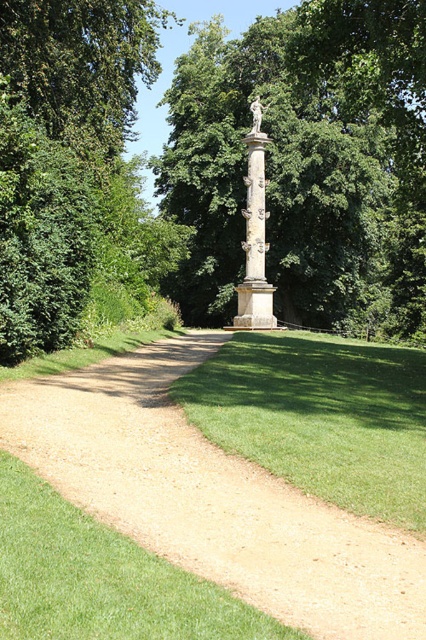
You are a landscape architect designing a garden layout. You need to place a new bench that requires a space larger than the green leafy tree at center. Can the beige stone column at center be used as a reference point for placement? Explain using the scene details.

The green leafy tree at center is bigger than the beige stone column at center. Since the bench requires a space larger than the tree, the beige stone column at center is smaller and cannot provide the necessary space reference. Choose a larger area instead.